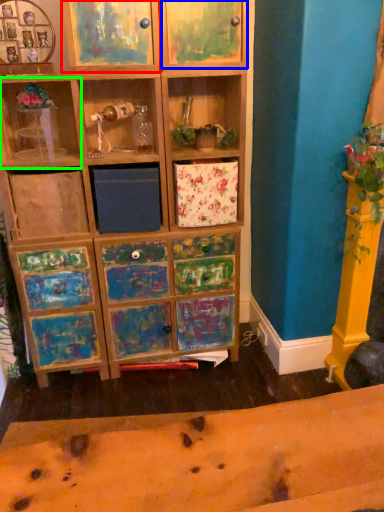
Question: Which is farther away from cabinet (highlighted by a red box)? cabinet (highlighted by a blue box) or shelf (highlighted by a green box)?

Choices:
 (A) cabinet
 (B) shelf

Answer: (B)